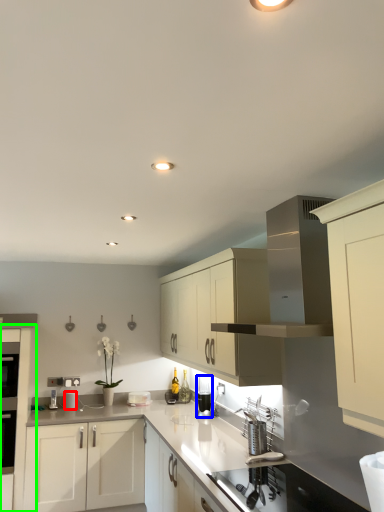
Question: Which object is the closest to the appliance (highlighted by a red box)? Choose among these: appliance (highlighted by a blue box) or cabinetry (highlighted by a green box).

Choices:
 (A) appliance
 (B) cabinetry

Answer: (B)